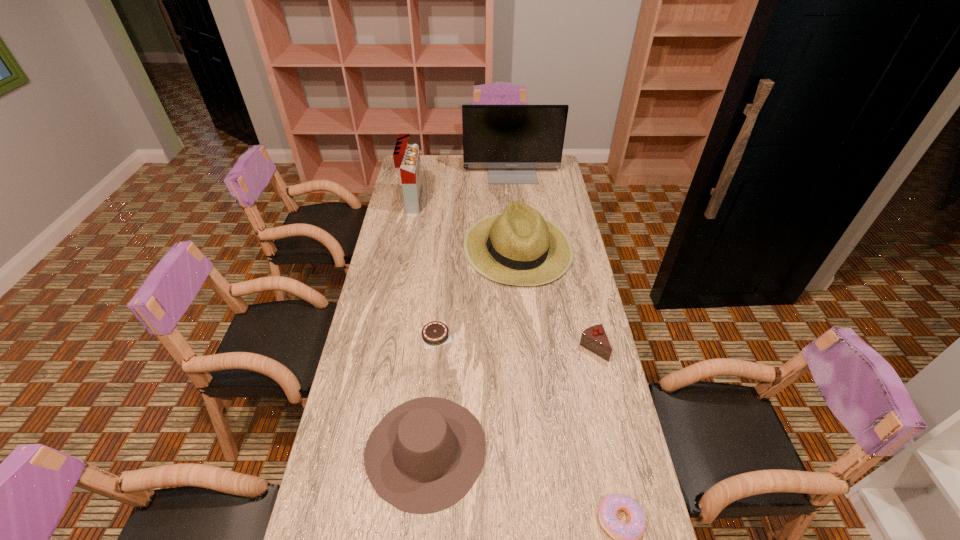
You are a GUI agent. You are given a task and a screenshot of the screen. Output one action in this format:
    pyautogui.click(x=<x>, y=<y>)
    Task: Click on the vacant position in the image that satisfies the following two spatial constraints: 1. on the screen of the farthest object; 2. with the lid open on the cigarette case
    This screenshot has height=540, width=960.
    Given the screenshot: What is the action you would take?
    pyautogui.click(x=515, y=202)

This screenshot has height=540, width=960. Identify the location of blank space that satisfies the following two spatial constraints: 1. with the lid open on the cigarette case; 2. on the left side of the third shortest object. (385, 348).

I want to click on blank area in the image that satisfies the following two spatial constraints: 1. on the back side of the right chocolate cake; 2. on the right side of the cowboy hat, so click(435, 348).

You are a GUI agent. You are given a task and a screenshot of the screen. Output one action in this format:
    pyautogui.click(x=<x>, y=<y>)
    Task: Click on the free region that satisfies the following two spatial constraints: 1. with the lid open on the sixth shortest object; 2. on the right side of the fifth shortest object
    
    Given the screenshot: What is the action you would take?
    pyautogui.click(x=404, y=247)